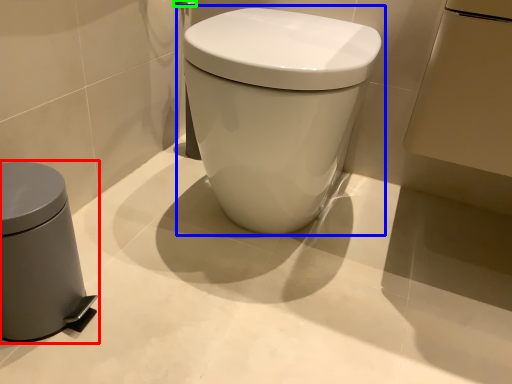
Question: Which object is positioned closest to waste container (highlighted by a red box)? Select from toilet (highlighted by a blue box) and towel bar (highlighted by a green box).

Choices:
 (A) toilet
 (B) towel bar

Answer: (A)